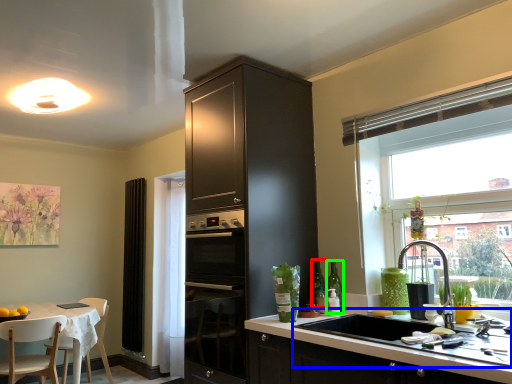
Question: Based on their relative distances, which object is nearer to bottle (highlighted by a red box)? Choose from sink (highlighted by a blue box) and bottle (highlighted by a green box).

Choices:
 (A) sink
 (B) bottle

Answer: (B)